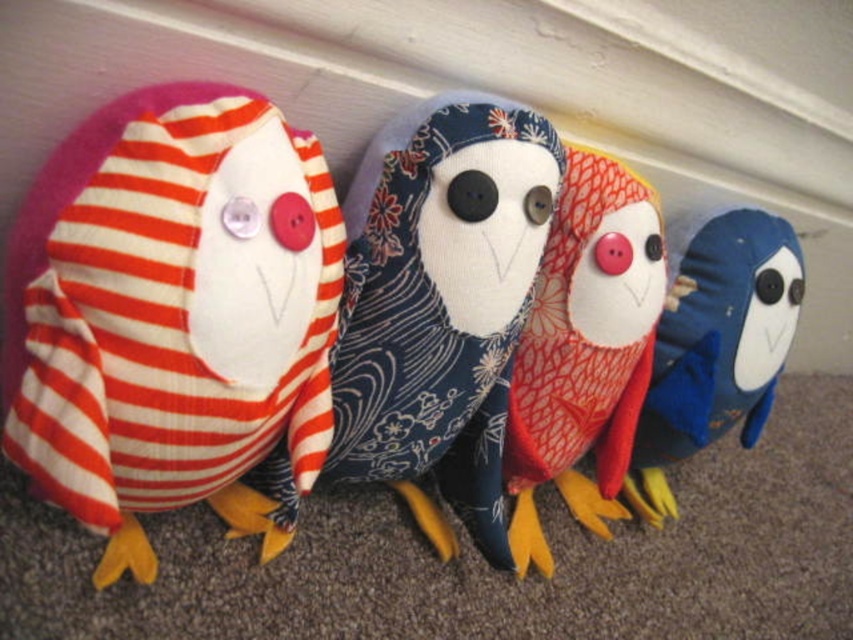
You are standing in front of the four plush birds arranged in a row against the wall. The red textured fabric owl at center is one of them. Can you determine its exact location using coordinates?

The red textured fabric owl at center is located at coordinates point [584,349].

You are a child who wants to place a ruler between the striped fabric owl at left and the red textured fabric owl at center. How far apart are these two birds?

The striped fabric owl at left and the red textured fabric owl at center are 17.20 inches apart.

Consider the image. You are standing in front of the four plush birds arranged on the carpeted floor. You notice two points marked in the scene. The first point is at coordinates point (640, 323) and the second point is at point (788, 225). Which of these two points is closer to your viewpoint?

Point (640, 323) is closer to the camera than point (788, 225).